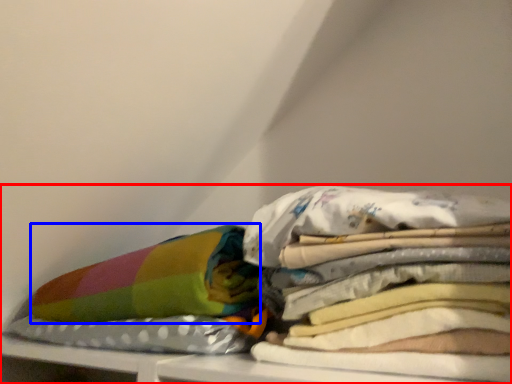
Question: Which of the following is the farthest to the observer, furniture (highlighted by a red box) or material (highlighted by a blue box)?

Choices:
 (A) furniture
 (B) material

Answer: (B)